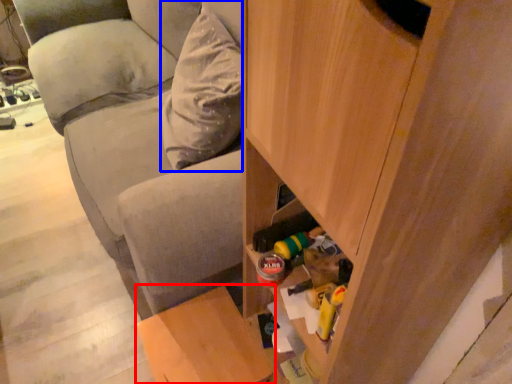
Question: Which object is closer to the camera taking this photo, furniture (highlighted by a red box) or pillow (highlighted by a blue box)?

Choices:
 (A) furniture
 (B) pillow

Answer: (A)